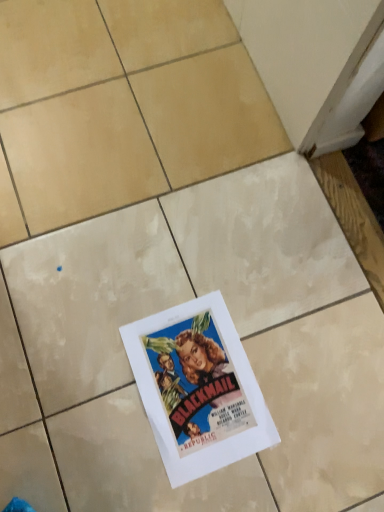
Where is `vacant space situated above matte paper poster at center (from a real-world perspective)`? The width and height of the screenshot is (384, 512). vacant space situated above matte paper poster at center (from a real-world perspective) is located at coordinates (201, 382).